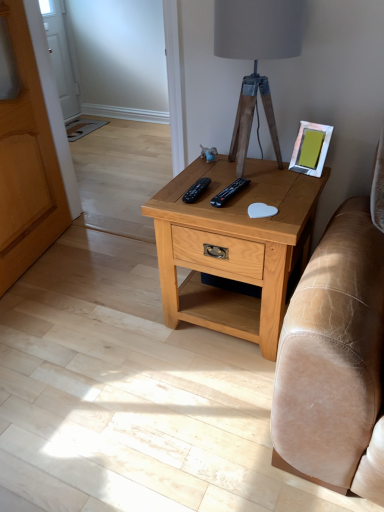
I want to click on free space in front of black plastic remote at center, placed as the first remote when sorted from left to right, so click(x=212, y=208).